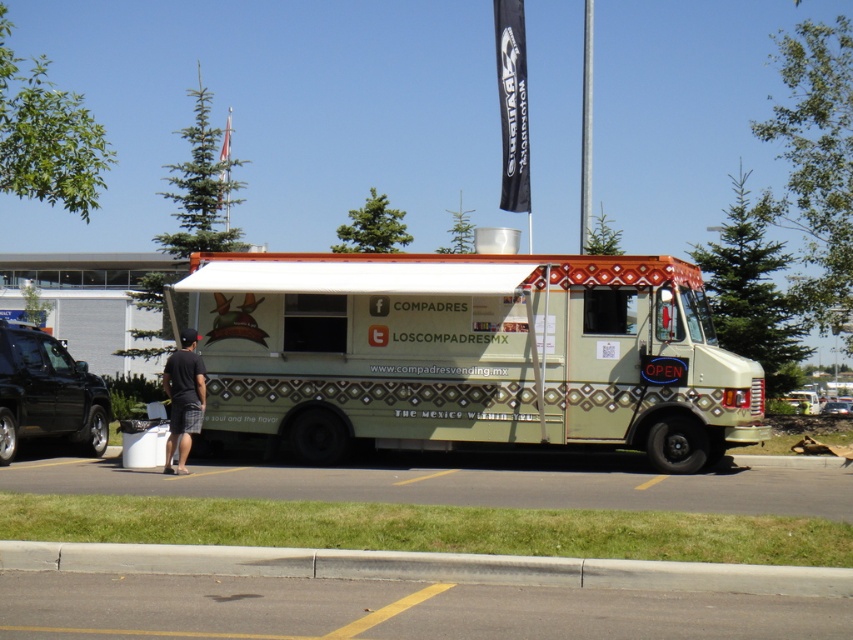
Can you confirm if green matte food truck at center is bigger than gray concrete curb at lower center?

Yes, green matte food truck at center is bigger than gray concrete curb at lower center.

Does green matte food truck at center have a lesser height compared to gray concrete curb at lower center?

No.

Is point (688, 461) positioned before point (4, 566)?

No, it is not.

In order to click on green matte food truck at center in this screenshot , I will do `click(469, 353)`.

Can you confirm if green matte food truck at center is bigger than dark gray shorts at lower left?

Actually, green matte food truck at center might be smaller than dark gray shorts at lower left.

Is point (318, 320) farther from viewer compared to point (189, 362)?

Yes, it is behind point (189, 362).

Does point (479, 308) come behind point (184, 454)?

Yes, point (479, 308) is behind point (184, 454).

Where is `green matte food truck at center`? This screenshot has height=640, width=853. green matte food truck at center is located at coordinates (469, 353).

Does gray concrete curb at lower center have a lesser width compared to dark gray shorts at lower left?

Incorrect, gray concrete curb at lower center's width is not less than dark gray shorts at lower left's.

Which is more to the right, gray concrete curb at lower center or dark gray shorts at lower left?

gray concrete curb at lower center

This screenshot has width=853, height=640. Find the location of `gray concrete curb at lower center`. gray concrete curb at lower center is located at coordinates (424, 566).

Locate an element on the screen. This screenshot has height=640, width=853. gray concrete curb at lower center is located at coordinates (424, 566).